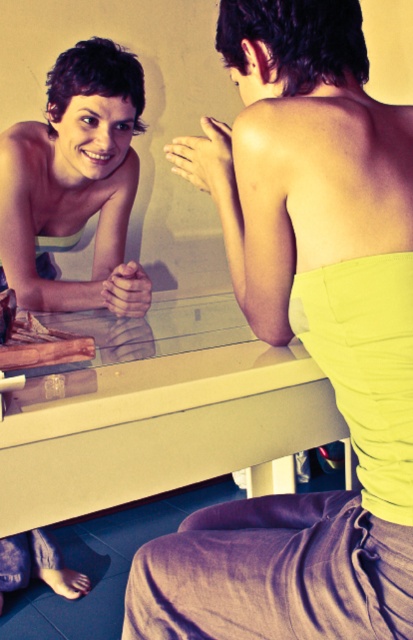
Question: Among these objects, which one is nearest to the camera?

Choices:
 (A) matte white tank top at upper left
 (B) matte glass table at center
 (C) matte yellow strapless top at upper right

Answer: (C)

Question: Can you confirm if matte yellow strapless top at upper right is bigger than matte white tank top at upper left?

Choices:
 (A) yes
 (B) no

Answer: (B)

Question: Among these objects, which one is farthest from the camera?

Choices:
 (A) matte glass table at center
 (B) matte white tank top at upper left

Answer: (B)

Question: Which object appears closest to the camera in this image?

Choices:
 (A) matte yellow strapless top at upper right
 (B) matte white tank top at upper left
 (C) matte glass table at center

Answer: (A)

Question: Where is matte yellow strapless top at upper right located in relation to matte glass table at center in the image?

Choices:
 (A) above
 (B) below

Answer: (A)

Question: Is matte yellow strapless top at upper right positioned in front of matte glass table at center?

Choices:
 (A) no
 (B) yes

Answer: (B)